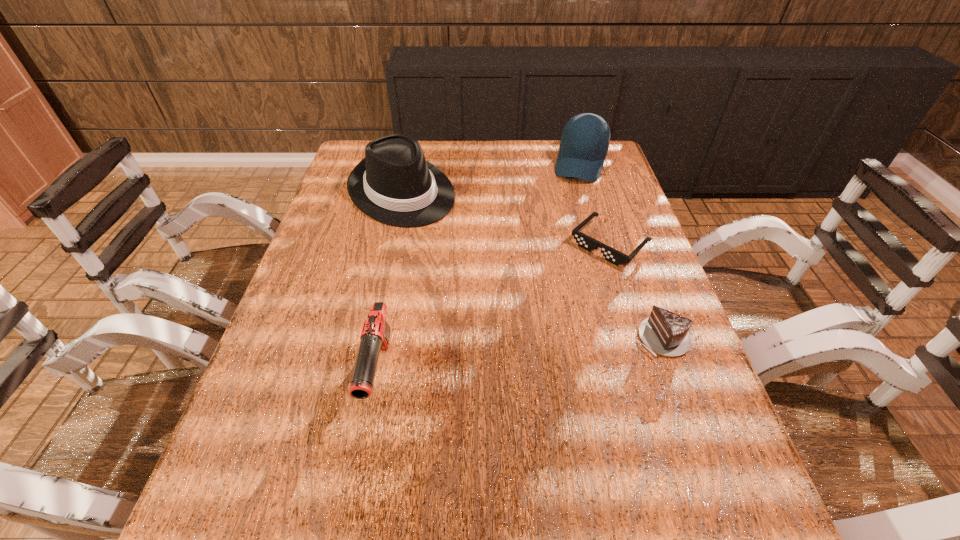
This screenshot has width=960, height=540. In order to click on vacant space located 0.270m on the front-facing side of the sunglasses in this screenshot , I will do `click(524, 325)`.

You are a GUI agent. You are given a task and a screenshot of the screen. Output one action in this format:
    pyautogui.click(x=<x>, y=<y>)
    Task: Click on the free region located 0.310m on the front-facing side of the sunglasses
    
    Given the screenshot: What is the action you would take?
    pyautogui.click(x=513, y=335)

You are a GUI agent. You are given a task and a screenshot of the screen. Output one action in this format:
    pyautogui.click(x=<x>, y=<y>)
    Task: Click on the vacant space located on the front-facing side of the sunglasses
    This screenshot has height=540, width=960.
    Given the screenshot: What is the action you would take?
    pyautogui.click(x=544, y=305)

At what (x,y) coordinates should I click in order to perform the action: click on free space located on the front-facing side of the fedora. Please return your answer as a coordinate pair (x, y). The image size is (960, 540). Looking at the image, I should click on (490, 282).

The image size is (960, 540). I want to click on vacant space located 0.390m on the front-facing side of the fedora, so pos(512,305).

Image resolution: width=960 pixels, height=540 pixels. In order to click on free space located on the front-facing side of the fedora in this screenshot , I will do `click(499, 292)`.

Identify the location of baseball cap at the far edge. (585, 139).

Locate an element on the screen. The image size is (960, 540). fedora present at the far edge is located at coordinates (394, 184).

This screenshot has height=540, width=960. In order to click on object that is at the left edge in this screenshot , I will do `click(394, 184)`.

At what (x,y) coordinates should I click in order to perform the action: click on chocolate cake located at the right edge. Please return your answer as a coordinate pair (x, y). Looking at the image, I should click on (666, 333).